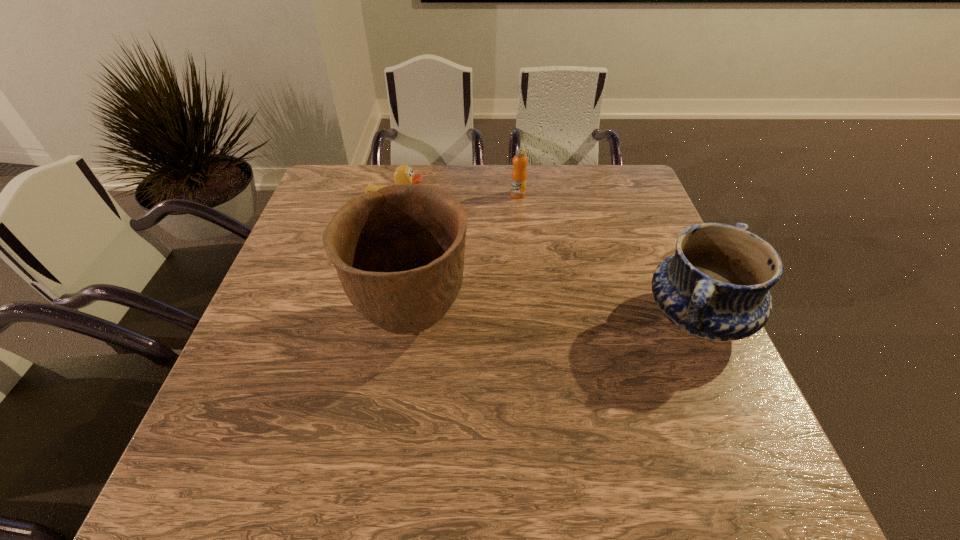
Where is `vacant space in between the third shortest object and the second farthest object`? The image size is (960, 540). vacant space in between the third shortest object and the second farthest object is located at coordinates (547, 263).

The height and width of the screenshot is (540, 960). In order to click on object identified as the third closest to the duck in this screenshot , I will do `click(716, 286)`.

You are a GUI agent. You are given a task and a screenshot of the screen. Output one action in this format:
    pyautogui.click(x=<x>, y=<y>)
    Task: Click on the closest object to the second farthest object
    This screenshot has width=960, height=540.
    Given the screenshot: What is the action you would take?
    pyautogui.click(x=398, y=251)

In order to click on free space that satisfies the following two spatial constraints: 1. on the front side of the duck; 2. on the left side of the third shortest object in this screenshot , I will do `click(373, 318)`.